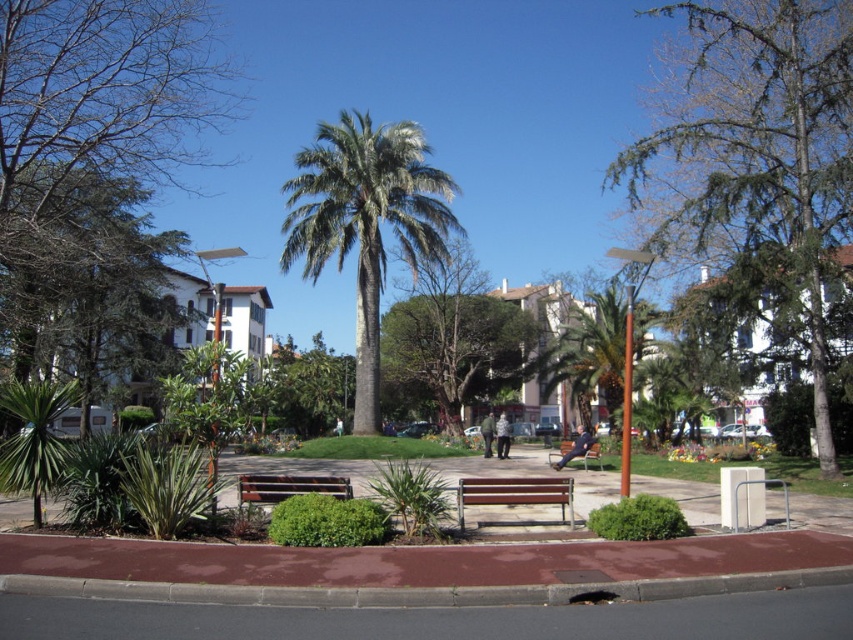
Is wooden bench at center smaller than brown wooden bench at center?

Yes.

Where is `wooden bench at center`? This screenshot has height=640, width=853. wooden bench at center is located at coordinates (515, 493).

Is point (537, 490) less distant than point (317, 481)?

Yes, point (537, 490) is in front of point (317, 481).

I want to click on wooden bench at center, so click(515, 493).

Can you confirm if green leafy tree at upper left is positioned to the right of wooden bench at center?

In fact, green leafy tree at upper left is to the left of wooden bench at center.

Who is shorter, green leafy tree at upper left or wooden bench at center?

Standing shorter between the two is wooden bench at center.

Which is in front, point (90, 308) or point (460, 531)?

Point (460, 531) is more forward.

Locate an element on the screen. Image resolution: width=853 pixels, height=640 pixels. green leafy tree at upper left is located at coordinates coord(93,157).

Which is in front, point (320, 128) or point (480, 490)?

Positioned in front is point (480, 490).

This screenshot has height=640, width=853. Describe the element at coordinates (364, 221) in the screenshot. I see `green leafy palm tree at center` at that location.

Describe the element at coordinates (364, 221) in the screenshot. I see `green leafy palm tree at center` at that location.

At what (x,y) coordinates should I click in order to perform the action: click on green leafy palm tree at center. Please return your answer as a coordinate pair (x, y). This screenshot has width=853, height=640. Looking at the image, I should click on 364,221.